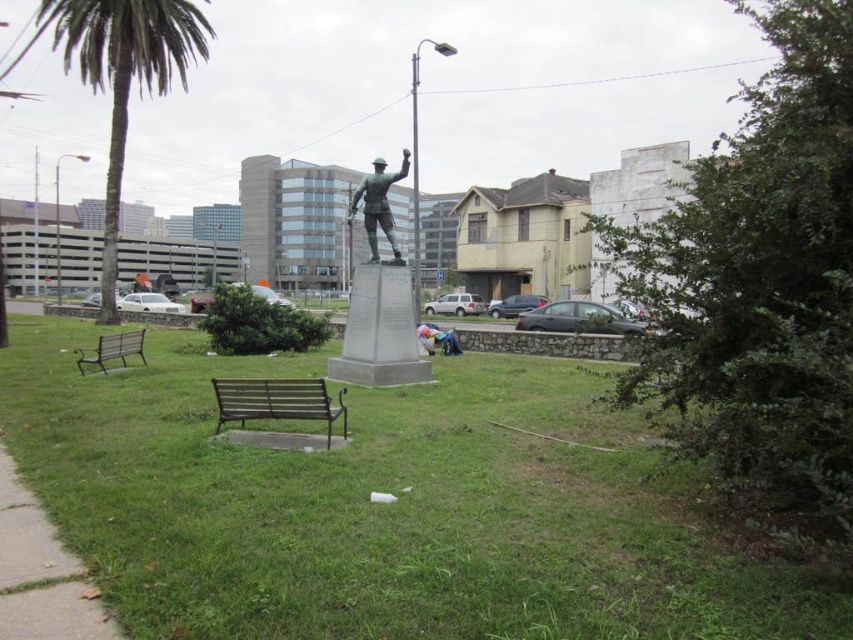
Question: Estimate the real-world distances between objects in this image. Which object is closer to the green leafy palm tree at left?

Choices:
 (A) bronze statue at center
 (B) gray concrete sidewalk at lower left
 (C) brown metal bench at lower left
 (D) green polished stone statue at center

Answer: (A)

Question: Which of the following is the farthest from the observer?

Choices:
 (A) bronze statue at center
 (B) blue denim jeans at center

Answer: (B)

Question: Is brown wooden bench at center to the right of bronze statue at center from the viewer's perspective?

Choices:
 (A) no
 (B) yes

Answer: (A)

Question: Which is farther from the blue denim jeans at center?

Choices:
 (A) green polished stone statue at center
 (B) green grass at center

Answer: (B)

Question: Does green polished stone statue at center have a lesser width compared to brown metal bench at lower left?

Choices:
 (A) no
 (B) yes

Answer: (A)

Question: Is green grass at center to the right of green polished stone statue at center from the viewer's perspective?

Choices:
 (A) yes
 (B) no

Answer: (A)